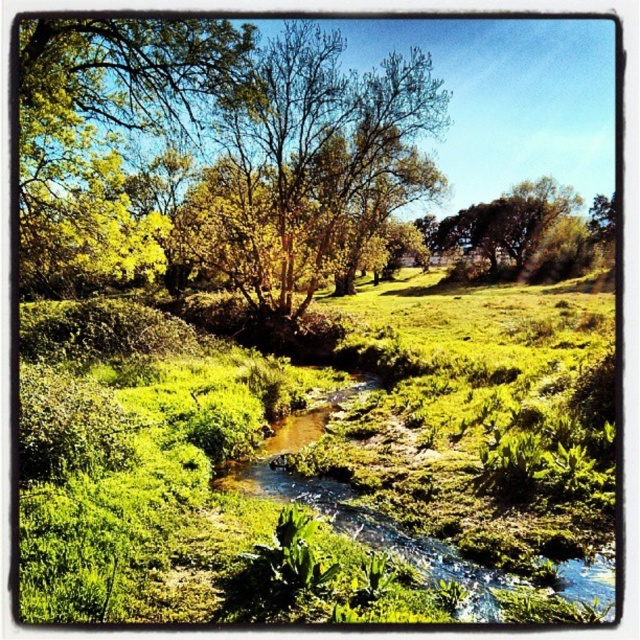
Question: Which is nearer to the green leafy grass at center?

Choices:
 (A) green leafy tree at center
 (B) clear water stream at center
 (C) green leafy tree at upper left
 (D) green leafy tree at upper center

Answer: (B)

Question: Which is nearer to the green leafy grass at center?

Choices:
 (A) green leafy tree at upper center
 (B) clear water stream at center

Answer: (B)

Question: Is green leafy grass at center positioned at the back of clear water stream at center?

Choices:
 (A) yes
 (B) no

Answer: (B)

Question: Can you confirm if green leafy grass at center is wider than green leafy tree at center?

Choices:
 (A) no
 (B) yes

Answer: (B)

Question: Does green leafy grass at center have a greater width compared to green leafy tree at center?

Choices:
 (A) no
 (B) yes

Answer: (B)

Question: Which point is farther to the camera?

Choices:
 (A) green leafy tree at center
 (B) green leafy tree at upper center
 (C) clear water stream at center

Answer: (B)